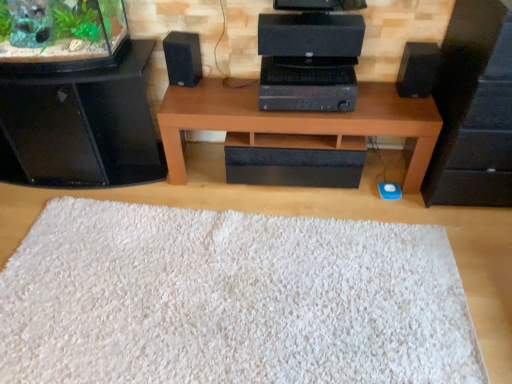
Question: Do you think black matte speaker at right, the second furniture from the left, is within brown wood table at center, or outside of it?

Choices:
 (A) inside
 (B) outside

Answer: (B)

Question: Looking at their shapes, would you say black matte speaker at right, the 1th furniture from the right, is wider or thinner than brown wood table at center?

Choices:
 (A) wide
 (B) thin

Answer: (A)

Question: Which is nearer to the black matte speaker at center?

Choices:
 (A) brown wood table at center
 (B) black matte speaker at right, marked as the 1th speaker in a right-to-left arrangement
 (C) white shaggy rug at center
 (D) black glossy speaker at left, arranged as the 1th furniture when viewed from the left
 (E) black matte speaker at right, the second furniture from the left

Answer: (A)

Question: Which of these objects is positioned closest to the black matte speaker at center?

Choices:
 (A) black matte speaker at right, the 2th speaker viewed from the left
 (B) white shaggy rug at center
 (C) brown wood table at center
 (D) green matte plant at upper left
 (E) black matte speaker at left, placed as the first speaker when sorted from left to right

Answer: (C)